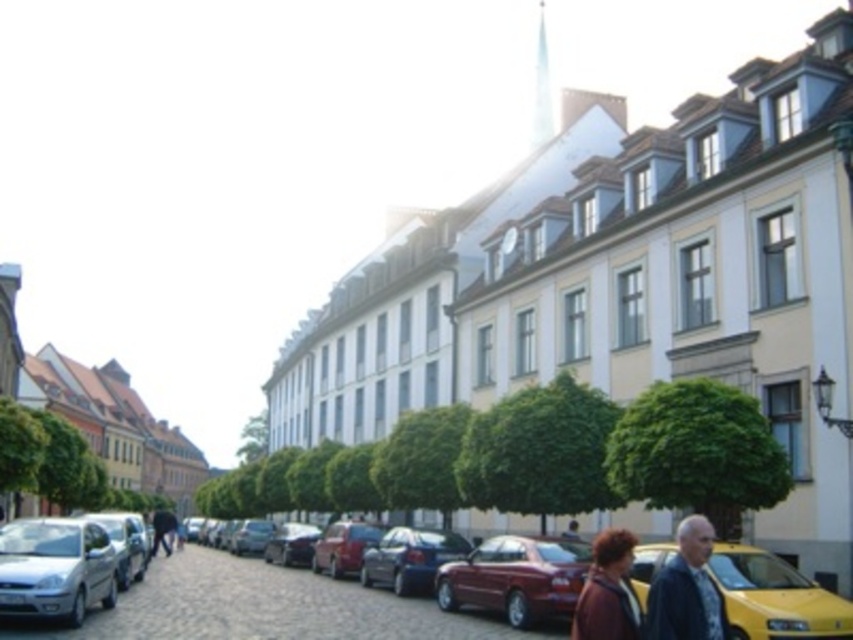
Can you confirm if shiny red car at center is shorter than silver metallic car at lower left?

No, shiny red car at center is not shorter than silver metallic car at lower left.

Between point (244, 586) and point (67, 618), which one is positioned in front?

Positioned in front is point (67, 618).

This screenshot has height=640, width=853. Identify the location of shiny red car at center. (775, 596).

Measure the distance between yellow matte taxi at lower right and shiny red convertible at center.

yellow matte taxi at lower right is 12.06 meters from shiny red convertible at center.

Between yellow matte taxi at lower right and shiny red convertible at center, which one appears on the left side from the viewer's perspective?

From the viewer's perspective, shiny red convertible at center appears more on the left side.

Locate an element on the screen. The image size is (853, 640). yellow matte taxi at lower right is located at coordinates (775, 596).

You are a GUI agent. You are given a task and a screenshot of the screen. Output one action in this format:
    pyautogui.click(x=<x>, y=<y>)
    Task: Click on the metallic red car at center
    
    Given the screenshot: What is the action you would take?
    pyautogui.click(x=343, y=547)

Who is shorter, metallic red car at center or dark blue jeans at center?

metallic red car at center is shorter.

Does point (345, 536) lie behind point (173, 524)?

No.

Locate an element on the screen. Image resolution: width=853 pixels, height=640 pixels. metallic red car at center is located at coordinates (343, 547).